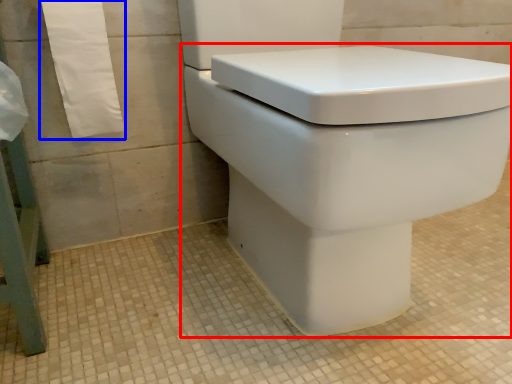
Question: Which point is closer to the camera, toilet (highlighted by a red box) or bath towel (highlighted by a blue box)?

Choices:
 (A) toilet
 (B) bath towel

Answer: (A)